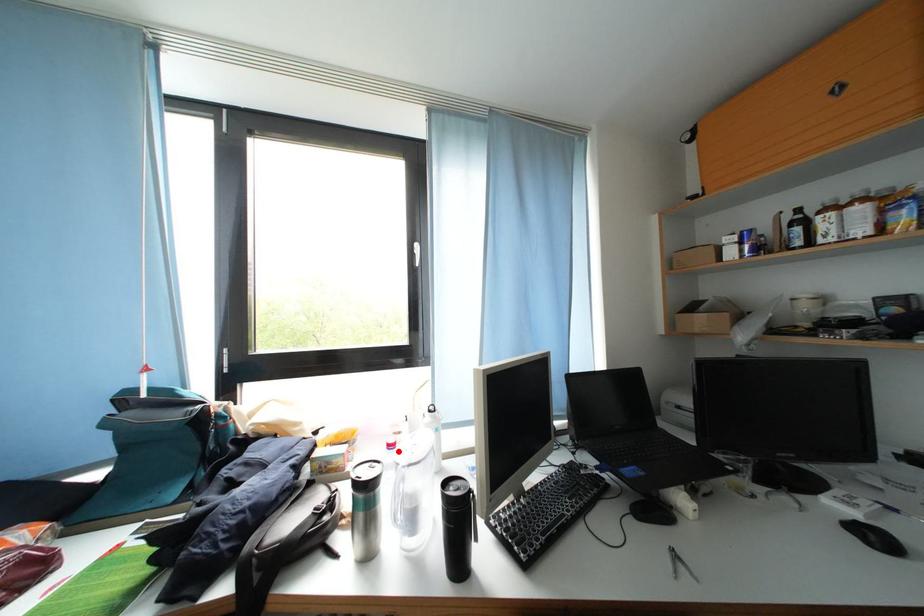
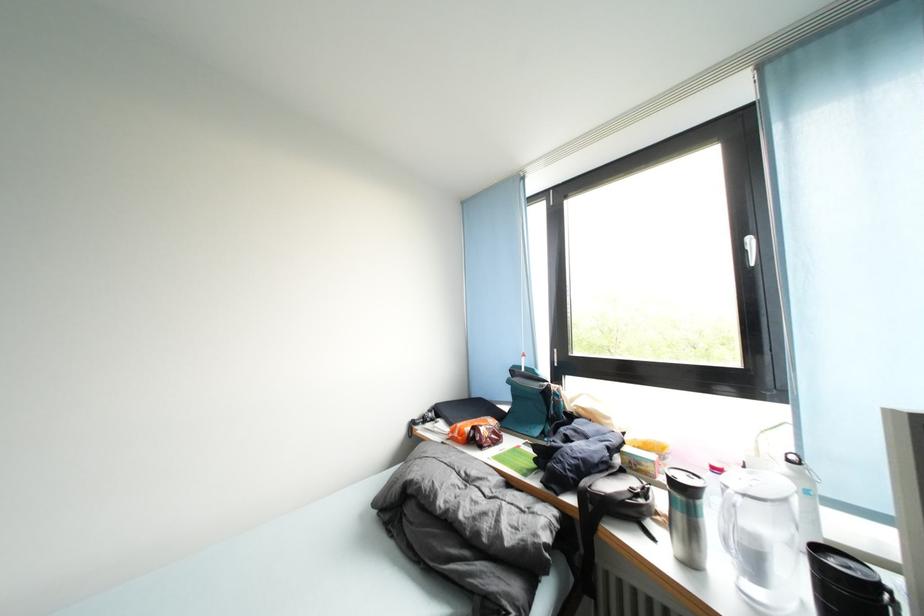
Question: I am providing you with two images of the same scene from different viewpoints. A red point is shown in image1. For the corresponding object point in image2, is it positioned nearer or farther from the camera?

Choices:
 (A) Nearer
 (B) Farther

Answer: (B)